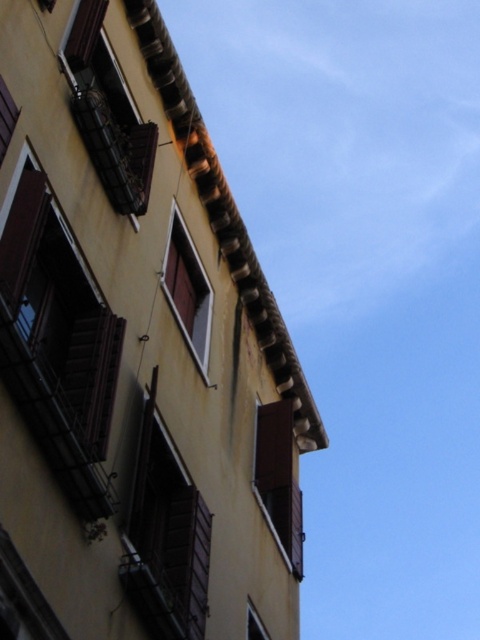
Is point (163, 627) positioned in front of point (248, 612)?

Yes.

Is point (168, 509) behind point (254, 625)?

That is False.

The image size is (480, 640). Find the location of `brown wooden window at center`. brown wooden window at center is located at coordinates (167, 536).

Can you confirm if brown wooden window at left is taller than wooden at upper left?

Correct, brown wooden window at left is much taller as wooden at upper left.

What do you see at coordinates (57, 320) in the screenshot? This screenshot has width=480, height=640. I see `brown wooden window at left` at bounding box center [57, 320].

What do you see at coordinates (57, 320) in the screenshot?
I see `brown wooden window at left` at bounding box center [57, 320].

Where is `brown wooden window at left`? This screenshot has width=480, height=640. brown wooden window at left is located at coordinates (57, 320).

Who is more forward, (151, 145) or (265, 634)?

Point (265, 634) is in front.

Describe the element at coordinates (108, 113) in the screenshot. Image resolution: width=480 pixels, height=640 pixels. I see `wooden at upper left` at that location.

Measure the distance between point (122, 125) and camera.

Point (122, 125) is 103.79 feet from camera.

Identify the location of wooden at upper left. (108, 113).